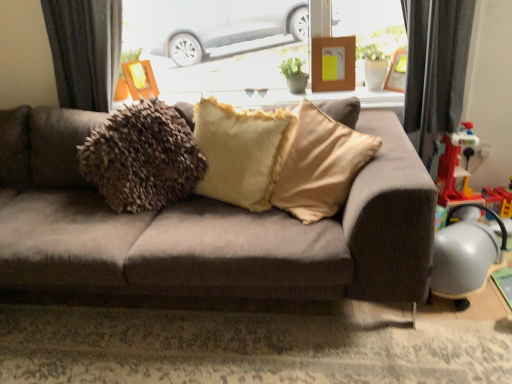
Where is `empty space that is to the right of wooden frame at upper center, the 3th picture frame viewed from the right`? The height and width of the screenshot is (384, 512). empty space that is to the right of wooden frame at upper center, the 3th picture frame viewed from the right is located at coordinates (176, 97).